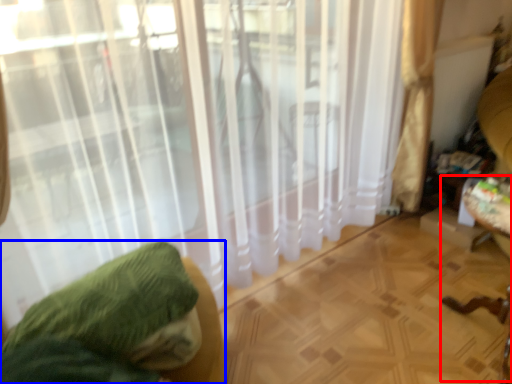
Question: Which of the following is the farthest to the observer, swivel chair (highlighted by a red box) or furniture (highlighted by a blue box)?

Choices:
 (A) swivel chair
 (B) furniture

Answer: (A)